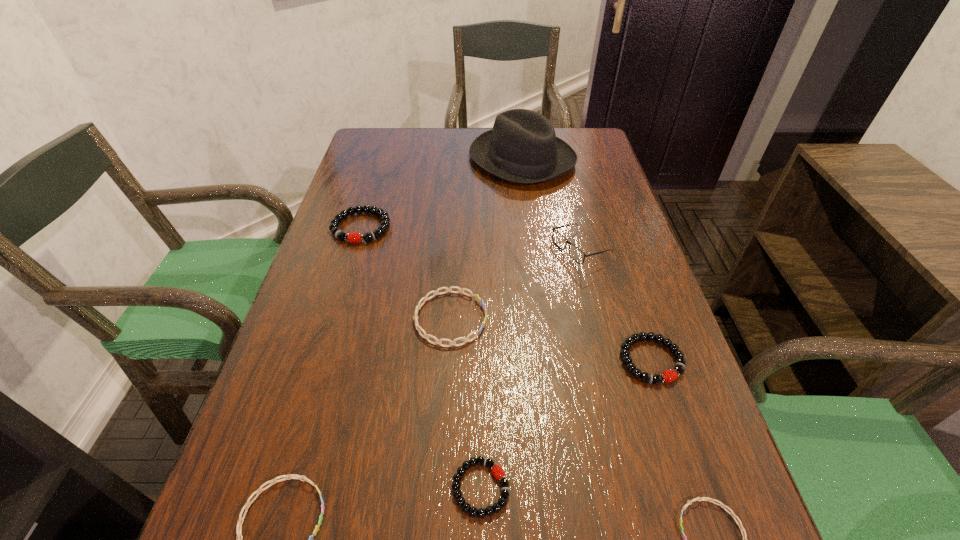
Locate an element on the screen. This screenshot has height=540, width=960. the farthest object is located at coordinates click(522, 147).

The width and height of the screenshot is (960, 540). In order to click on fedora in this screenshot , I will do `click(522, 147)`.

Locate an element on the screen. This screenshot has height=540, width=960. the second tallest object is located at coordinates (575, 253).

At what (x,y) coordinates should I click in order to perform the action: click on the biggest black bracelet. Please return your answer as a coordinate pair (x, y). Image resolution: width=960 pixels, height=540 pixels. Looking at the image, I should click on (353, 237).

In order to click on the farthest bracelet in this screenshot , I will do pyautogui.click(x=353, y=237).

You are a GUI agent. You are given a task and a screenshot of the screen. Output one action in this format:
    pyautogui.click(x=<x>, y=<y>)
    Task: Click on the biggest blue bracelet
    The image size is (960, 540).
    Given the screenshot: What is the action you would take?
    pyautogui.click(x=426, y=336)

I want to click on the farthest blue bracelet, so click(x=426, y=336).

Identify the location of the rightmost black bracelet. (668, 376).

Locate an element on the screen. The width and height of the screenshot is (960, 540). the second nearest black bracelet is located at coordinates (668, 376).

Image resolution: width=960 pixels, height=540 pixels. I want to click on the smallest black bracelet, so click(x=497, y=471).